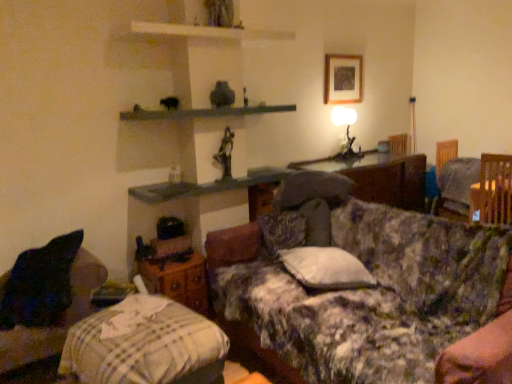
The image size is (512, 384). Describe the element at coordinates (202, 112) in the screenshot. I see `smooth gray stone mantle at upper center` at that location.

Measure the distance between point (26, 341) and camera.

Point (26, 341) is 2.20 meters from camera.

Image resolution: width=512 pixels, height=384 pixels. In order to click on white soft pillow at center in this screenshot , I will do `click(326, 268)`.

The height and width of the screenshot is (384, 512). What do you see at coordinates (326, 268) in the screenshot?
I see `white soft pillow at center` at bounding box center [326, 268].

Describe the element at coordinates (179, 281) in the screenshot. The width and height of the screenshot is (512, 384). I see `wooden at left` at that location.

Find the location of a particular element. The width and height of the screenshot is (512, 384). wooden swivel chair at right is located at coordinates (493, 190).

Locate an element on the screen. This screenshot has height=384, width=512. wooden picture frame at upper center is located at coordinates (343, 79).

Locate an element on the screen. The width and height of the screenshot is (512, 384). floral fabric couch at center is located at coordinates (371, 294).

Locate an element on the screen. This screenshot has height=384, width=512. smooth gray stone mantle at upper center is located at coordinates (202, 112).

Consider the image. Considering the sizes of objects white soft pillow at center and wooden picture frame at upper center in the image provided, who is smaller, white soft pillow at center or wooden picture frame at upper center?

wooden picture frame at upper center.

Which is more to the left, white soft pillow at center or wooden picture frame at upper center?

white soft pillow at center is more to the left.

Is white soft pillow at center positioned with its back to wooden picture frame at upper center?

No, white soft pillow at center's orientation is not away from wooden picture frame at upper center.

Are white soft pillow at center and wooden picture frame at upper center located far from each other?

white soft pillow at center is positioned a significant distance from wooden picture frame at upper center.

Considering their positions, is smooth gray stone mantle at upper center located in front of or behind white soft pillow at center?

smooth gray stone mantle at upper center is behind white soft pillow at center.

Is smooth gray stone mantle at upper center bigger or smaller than white soft pillow at center?

Clearly, smooth gray stone mantle at upper center is larger in size than white soft pillow at center.

Based on the photo, from the image's perspective, who appears lower, smooth gray stone mantle at upper center or white soft pillow at center?

white soft pillow at center is shown below in the image.

Find the location of a particular element. This screenshot has width=512, height=384. mantle above the white soft pillow at center (from a real-world perspective) is located at coordinates (202, 112).

You are a GUI agent. You are given a task and a screenshot of the screen. Output one action in this format:
    pyautogui.click(x=<x>, y=<y>)
    Task: Click on the bedding below the wooden picture frame at upper center (from a real-world perspective)
    
    Given the screenshot: What is the action you would take?
    pyautogui.click(x=142, y=344)

Does striped cotton blanket at lower left have a larger size compared to wooden picture frame at upper center?

Correct, striped cotton blanket at lower left is larger in size than wooden picture frame at upper center.

Considering the relative positions of striped cotton blanket at lower left and wooden picture frame at upper center in the image provided, is striped cotton blanket at lower left to the left of wooden picture frame at upper center from the viewer's perspective?

Yes.

Considering the sizes of objects striped cotton blanket at lower left and wooden picture frame at upper center in the image provided, who is thinner, striped cotton blanket at lower left or wooden picture frame at upper center?

wooden picture frame at upper center.

Which point is more distant from viewer, (359, 97) or (130, 355)?

The point (359, 97) is behind.

I want to click on bedding in front of the wooden picture frame at upper center, so [142, 344].

Between wooden picture frame at upper center and striped cotton blanket at lower left, which one has larger width?

Wider between the two is striped cotton blanket at lower left.

Is wooden picture frame at upper center oriented towards striped cotton blanket at lower left?

No, wooden picture frame at upper center is not oriented towards striped cotton blanket at lower left.

Which is closer to the camera, (60, 350) or (186, 339)?

Point (60, 350) is positioned farther from the camera compared to point (186, 339).

From a real-world perspective, is velvet dark blue pillow at lower left located beneath striped cotton blanket at lower left?

No, from a real-world perspective, velvet dark blue pillow at lower left is not beneath striped cotton blanket at lower left.

Can you confirm if velvet dark blue pillow at lower left is positioned to the right of striped cotton blanket at lower left?

No.

Considering the relative sizes of velvet dark blue pillow at lower left and striped cotton blanket at lower left in the image provided, is velvet dark blue pillow at lower left shorter than striped cotton blanket at lower left?

No, velvet dark blue pillow at lower left is not shorter than striped cotton blanket at lower left.

Can you confirm if smooth gray stone mantle at upper center is smaller than metallic bronze table lamp at upper right?

Actually, smooth gray stone mantle at upper center might be larger than metallic bronze table lamp at upper right.

Who is taller, smooth gray stone mantle at upper center or metallic bronze table lamp at upper right?

metallic bronze table lamp at upper right.

Is metallic bronze table lamp at upper right at the back of smooth gray stone mantle at upper center?

smooth gray stone mantle at upper center is not turned away from metallic bronze table lamp at upper right.

From a real-world perspective, does smooth gray stone mantle at upper center sit lower than metallic bronze table lamp at upper right?

No, from a real-world perspective, smooth gray stone mantle at upper center is not below metallic bronze table lamp at upper right.

Would you say wooden swivel chair at right is to the left or to the right of wooden picture frame at upper center in the picture?

wooden swivel chair at right is positioned on wooden picture frame at upper center's right side.

Is wooden swivel chair at right inside or outside of wooden picture frame at upper center?

wooden swivel chair at right lies outside wooden picture frame at upper center.

At what (x,y) coordinates should I click in order to perform the action: click on picture frame above the wooden swivel chair at right (from a real-world perspective). Please return your answer as a coordinate pair (x, y). Looking at the image, I should click on (343, 79).

Is point (475, 203) closer or farther from the camera than point (360, 83)?

Point (475, 203) is positioned closer to the camera compared to point (360, 83).

Find the location of a particular element. pillow that is under the wooden picture frame at upper center (from a real-world perspective) is located at coordinates (326, 268).

At what (x,y) coordinates should I click in order to perform the action: click on mantle located on the left of white soft pillow at center. Please return your answer as a coordinate pair (x, y). Looking at the image, I should click on (202, 112).

From the image, which object appears to be farther from metallic bronze table lamp at upper right, metallic statue at upper center or wooden swivel chair at right?

metallic statue at upper center is positioned further to the anchor metallic bronze table lamp at upper right.

Based on their spatial positions, is wooden picture frame at upper center or wooden swivel chair at right closer to metallic bronze table lamp at upper right?

wooden picture frame at upper center is closer to metallic bronze table lamp at upper right.

From the image, which object appears to be nearer to wooden swivel chair at right, white soft pillow at center or smooth gray stone mantle at upper center?

The object closer to wooden swivel chair at right is white soft pillow at center.

Based on their spatial positions, is wooden picture frame at upper center or metallic bronze table lamp at upper right closer to floral fabric couch at center?

Based on the image, metallic bronze table lamp at upper right appears to be nearer to floral fabric couch at center.

From the image, which object appears to be nearer to wooden picture frame at upper center, metallic statue at upper center or metallic bronze table lamp at upper right?

Based on the image, metallic bronze table lamp at upper right appears to be nearer to wooden picture frame at upper center.

Looking at this image, which object lies nearer to the anchor point smooth gray stone mantle at upper center, floral fabric couch at center or metallic statue at upper center?

Among the two, metallic statue at upper center is located nearer to smooth gray stone mantle at upper center.

Estimate the real-world distances between objects in this image. Which object is further from smooth gray stone mantle at upper center, velvet dark blue pillow at lower left or wooden at left?

velvet dark blue pillow at lower left is positioned further to the anchor smooth gray stone mantle at upper center.

Estimate the real-world distances between objects in this image. Which object is closer to metallic statue at upper center, smooth gray stone mantle at upper center or metallic bronze table lamp at upper right?

The object closer to metallic statue at upper center is smooth gray stone mantle at upper center.

Image resolution: width=512 pixels, height=384 pixels. Find the location of `mantle between velvet dark blue pillow at lower left and wooden swivel chair at right from left to right`. mantle between velvet dark blue pillow at lower left and wooden swivel chair at right from left to right is located at coordinates (202, 112).

Where is `toy between velvet dark blue pillow at lower left and wooden swivel chair at right from left to right`? The image size is (512, 384). toy between velvet dark blue pillow at lower left and wooden swivel chair at right from left to right is located at coordinates (225, 153).

I want to click on picture frame situated between smooth gray stone mantle at upper center and wooden swivel chair at right from left to right, so click(343, 79).

The height and width of the screenshot is (384, 512). I want to click on toy located between white soft pillow at center and metallic bronze table lamp at upper right in the depth direction, so click(x=225, y=153).